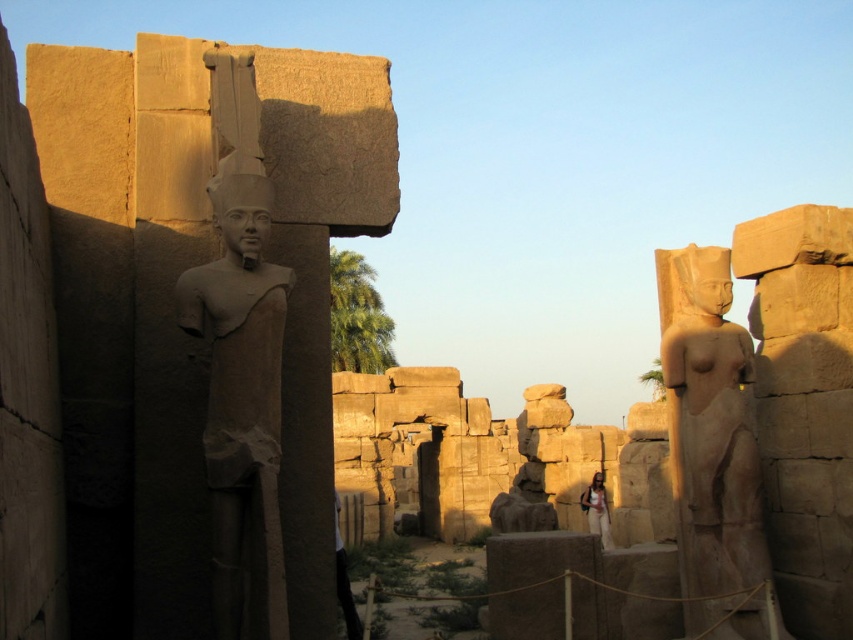
You are an archaeologist examining the ancient Egyptian temple ruins. You notice the smooth beige statue at right and the light brown stone statue at center. Which statue is placed higher in the scene?

The smooth beige statue at right is positioned over the light brown stone statue at center, meaning it is placed higher.

Where is the gray stone statue at left located in the image?

The gray stone statue at left is located at point [242,397] in the image.